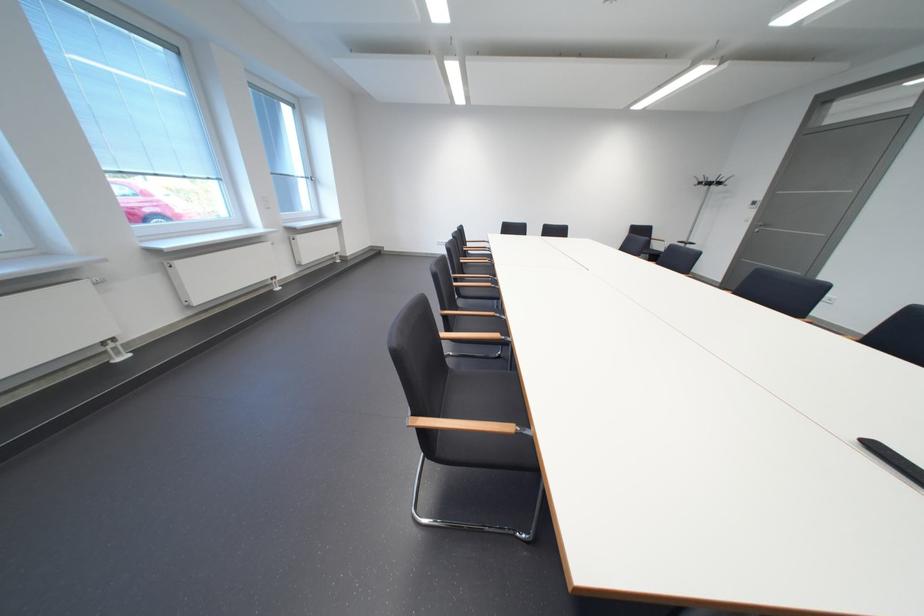
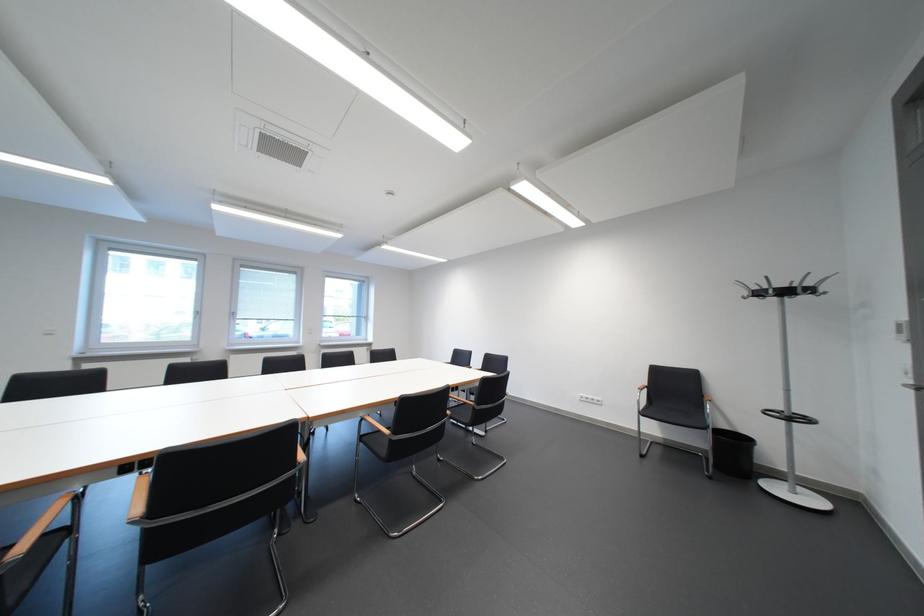
Question: I am providing you with two images of the same scene from different viewpoints. Please identify which objects are invisible in image2.

Choices:
 (A) black chair sitting surface
 (B) metal door handle
 (C) wooden chair armrest
 (D) none of these

Answer: (D)